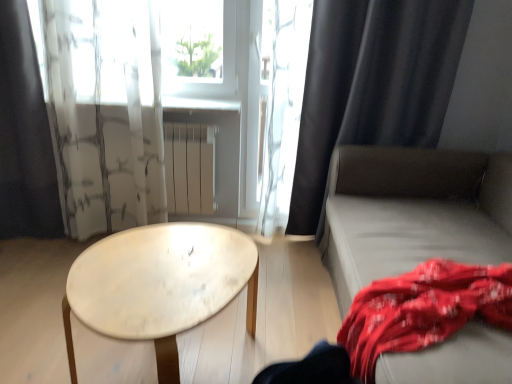
Locate an element on the screen. Image resolution: width=512 pixels, height=384 pixels. free spot above white marble table at center (from a real-world perspective) is located at coordinates (156, 272).